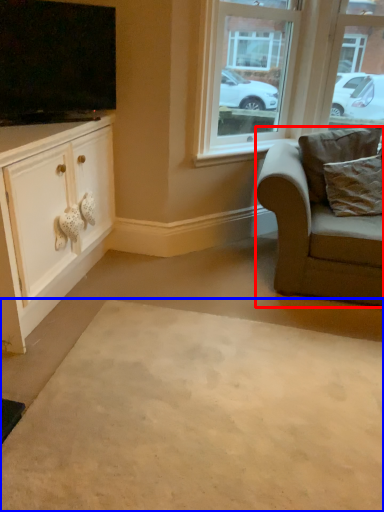
Question: Which object is closer to the camera taking this photo, chair (highlighted by a red box) or plain (highlighted by a blue box)?

Choices:
 (A) chair
 (B) plain

Answer: (B)